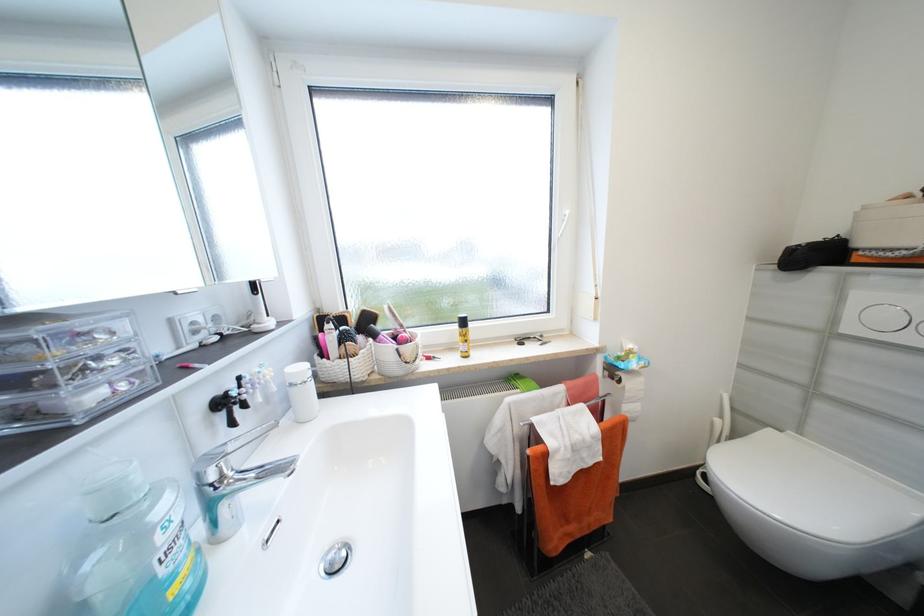
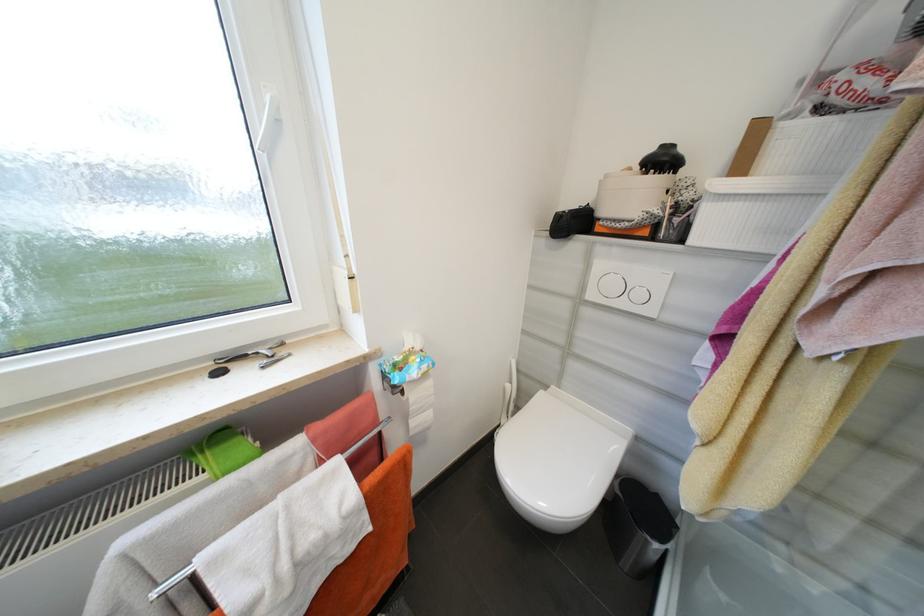
Where in the second image is the point corresponding to the point at 784,431 from the first image?

(552, 387)